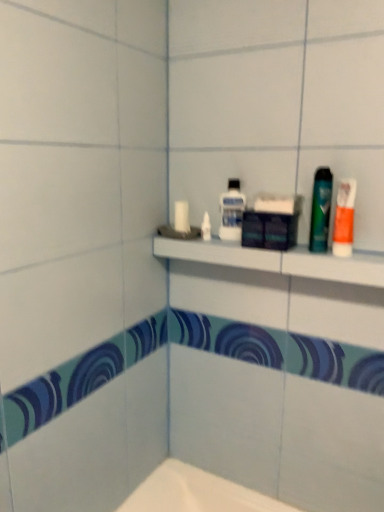
Question: Is white plastic shelf at upper center placed right next to clear plastic mouthwash at upper center, positioned as the first mouthwash in left-to-right order?

Choices:
 (A) yes
 (B) no

Answer: (B)

Question: Can you confirm if white plastic shelf at upper center is positioned to the right of clear plastic mouthwash at upper center, positioned as the second mouthwash in right-to-left order?

Choices:
 (A) yes
 (B) no

Answer: (A)

Question: Could you tell me if white plastic shelf at upper center is facing clear plastic mouthwash at upper center, which is the second mouthwash in front-to-back order?

Choices:
 (A) no
 (B) yes

Answer: (A)

Question: Is white plastic shelf at upper center positioned with its back to clear plastic mouthwash at upper center, positioned as the second mouthwash in right-to-left order?

Choices:
 (A) no
 (B) yes

Answer: (A)

Question: From a real-world perspective, does white plastic shelf at upper center sit lower than clear plastic mouthwash at upper center, positioned as the first mouthwash in left-to-right order?

Choices:
 (A) no
 (B) yes

Answer: (B)

Question: In terms of size, does orange matte toothpaste at right appear bigger or smaller than white plastic shelf at upper center?

Choices:
 (A) big
 (B) small

Answer: (B)

Question: Considering the positions of point (340, 190) and point (276, 266), is point (340, 190) closer or farther from the camera than point (276, 266)?

Choices:
 (A) closer
 (B) farther

Answer: (A)

Question: In the image, is orange matte toothpaste at right on the left side or the right side of white plastic shelf at upper center?

Choices:
 (A) left
 (B) right

Answer: (B)

Question: Is orange matte toothpaste at right taller or shorter than white plastic shelf at upper center?

Choices:
 (A) tall
 (B) short

Answer: (A)

Question: In the image, is white plastic shelf at upper center on the left side or the right side of clear plastic mouthwash at upper center, positioned as the first mouthwash in left-to-right order?

Choices:
 (A) right
 (B) left

Answer: (A)

Question: Does point (274, 261) appear closer or farther from the camera than point (230, 230)?

Choices:
 (A) farther
 (B) closer

Answer: (B)

Question: Looking at the image, does white plastic shelf at upper center seem bigger or smaller compared to clear plastic mouthwash at upper center, marked as the 1th mouthwash in a back-to-front arrangement?

Choices:
 (A) big
 (B) small

Answer: (A)

Question: Looking at their shapes, would you say white plastic shelf at upper center is wider or thinner than clear plastic mouthwash at upper center, positioned as the second mouthwash in right-to-left order?

Choices:
 (A) wide
 (B) thin

Answer: (A)

Question: Is green glossy mouthwash at right, acting as the second mouthwash starting from the left, spatially inside clear plastic mouthwash at upper center, marked as the 1th mouthwash in a back-to-front arrangement, or outside of it?

Choices:
 (A) outside
 (B) inside

Answer: (A)

Question: In the image, is green glossy mouthwash at right, acting as the second mouthwash starting from the left, positioned in front of or behind clear plastic mouthwash at upper center, marked as the 1th mouthwash in a back-to-front arrangement?

Choices:
 (A) behind
 (B) front

Answer: (B)